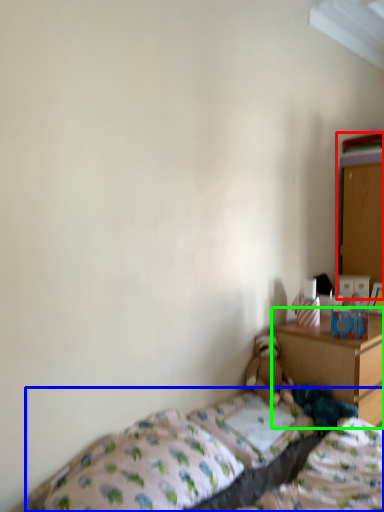
Question: Which object is the farthest from dresser (highlighted by a red box)? Choose among these: bed (highlighted by a blue box) or nightstand (highlighted by a green box).

Choices:
 (A) bed
 (B) nightstand

Answer: (A)